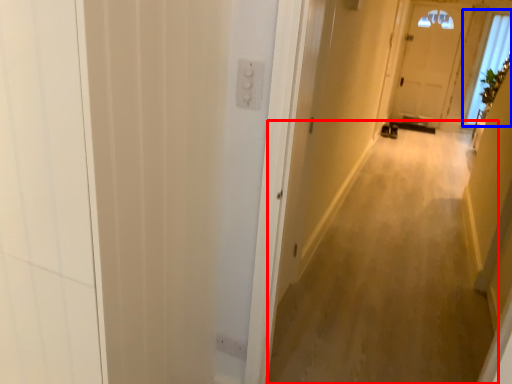
Question: Among these objects, which one is farthest to the camera, corridor (highlighted by a red box) or window (highlighted by a blue box)?

Choices:
 (A) corridor
 (B) window

Answer: (B)